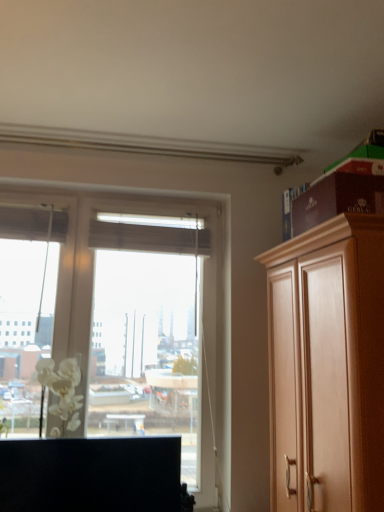
Question: Is black matte cabinet at lower left, which is counted as the second cabinetry, starting from the right, not within wooden cabinet at right, which is the second cabinetry in left-to-right order?

Choices:
 (A) yes
 (B) no

Answer: (A)

Question: Considering the relative sizes of black matte cabinet at lower left, which is counted as the second cabinetry, starting from the right, and wooden cabinet at right, the 1th cabinetry positioned from the right, in the image provided, is black matte cabinet at lower left, which is counted as the second cabinetry, starting from the right, bigger than wooden cabinet at right, the 1th cabinetry positioned from the right,?

Choices:
 (A) yes
 (B) no

Answer: (B)

Question: Is black matte cabinet at lower left, which is counted as the second cabinetry, starting from the right, to the right of wooden cabinet at right, the 1th cabinetry positioned from the right, from the viewer's perspective?

Choices:
 (A) no
 (B) yes

Answer: (A)

Question: From the image's perspective, would you say black matte cabinet at lower left, marked as the first cabinetry in a left-to-right arrangement, is positioned over wooden cabinet at right, the 1th cabinetry positioned from the right?

Choices:
 (A) yes
 (B) no

Answer: (B)

Question: Does black matte cabinet at lower left, marked as the first cabinetry in a left-to-right arrangement, turn towards wooden cabinet at right, the 1th cabinetry positioned from the right?

Choices:
 (A) no
 (B) yes

Answer: (A)

Question: Can you confirm if black matte cabinet at lower left, which is counted as the second cabinetry, starting from the right, is thinner than wooden cabinet at right, which is the second cabinetry in left-to-right order?

Choices:
 (A) yes
 (B) no

Answer: (A)

Question: Is white matte flower at left positioned beyond the bounds of black matte cabinet at lower left, which is counted as the second cabinetry, starting from the right?

Choices:
 (A) no
 (B) yes

Answer: (B)

Question: Is black matte cabinet at lower left, which is counted as the second cabinetry, starting from the right, completely or partially inside white matte flower at left?

Choices:
 (A) yes
 (B) no

Answer: (B)

Question: Can you confirm if white matte flower at left is wider than black matte cabinet at lower left, which is counted as the second cabinetry, starting from the right?

Choices:
 (A) no
 (B) yes

Answer: (B)

Question: Is white matte flower at left looking in the opposite direction of black matte cabinet at lower left, which is counted as the second cabinetry, starting from the right?

Choices:
 (A) no
 (B) yes

Answer: (A)

Question: From the image's perspective, is white matte flower at left over black matte cabinet at lower left, marked as the first cabinetry in a left-to-right arrangement?

Choices:
 (A) no
 (B) yes

Answer: (B)

Question: Is white matte flower at left shorter than black matte cabinet at lower left, which is counted as the second cabinetry, starting from the right?

Choices:
 (A) yes
 (B) no

Answer: (A)

Question: Does white matte flower at left have a lesser width compared to wooden cabinet at right, which is the second cabinetry in left-to-right order?

Choices:
 (A) yes
 (B) no

Answer: (A)